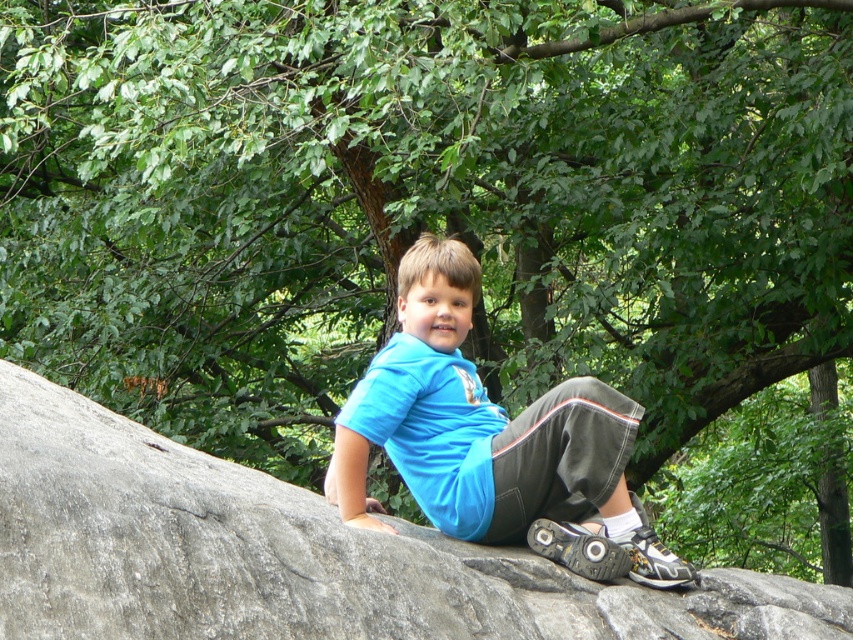
Which is below, gray rough rock at center or blue fabric shirt at center?

Positioned lower is blue fabric shirt at center.

Is gray rough rock at center further to the viewer compared to blue fabric shirt at center?

No, it is in front of blue fabric shirt at center.

Which is behind, point (44, 435) or point (476, 458)?

Point (476, 458)

This screenshot has width=853, height=640. Identify the location of gray rough rock at center. (296, 556).